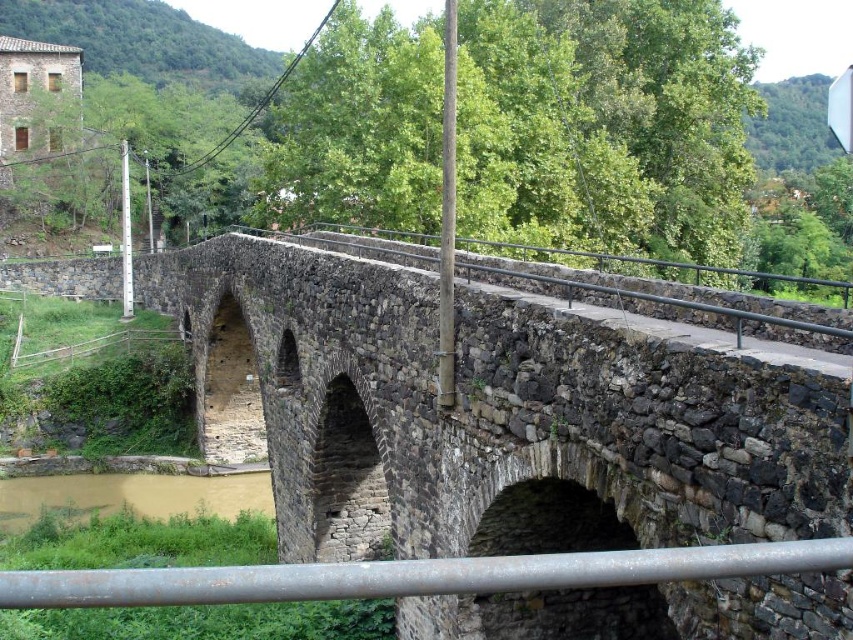
You are a photographer standing on the rusty metal rail at lower center, aiming to capture the rustic stone bridge at center in your shot. Considering their heights, will the bridge appear taller than the rail in your photograph?

Yes, the rustic stone bridge at center has a greater height compared to the rusty metal rail at lower center, so it will appear taller in the photograph.

You are a construction worker needing to place a 15 meter long safety net between the rustic stone bridge at center and the brown muddy water at lower left. Can the safety net be placed without overlapping the bridge or the water?

The distance between the rustic stone bridge at center and the brown muddy water at lower left is 14.99 meters. Since the safety net is 15 meters long, it will be slightly too long to fit without overlapping either the bridge or the water.

You are a photographer standing at the edge of the stone bridge. You want to capture a clear view of the brown muddy water at lower left without the rusty metal rail at lower center blocking the shot. Is this possible?

The rusty metal rail at lower center is much taller than the brown muddy water at lower left, so it will block the view of the water. To capture a clear view of the brown muddy water at lower left, you might need to lower your camera angle or move to a position where the rail is not in front of the water.